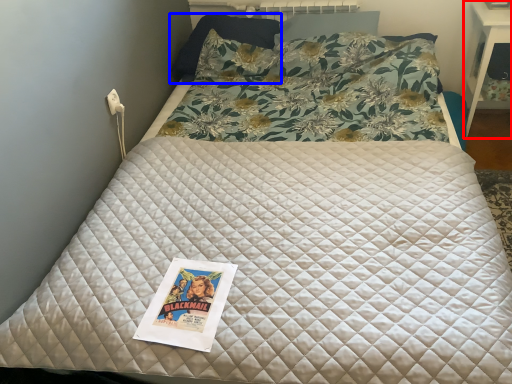
Question: Which point is closer to the camera, table (highlighted by a red box) or pillow (highlighted by a blue box)?

Choices:
 (A) table
 (B) pillow

Answer: (A)